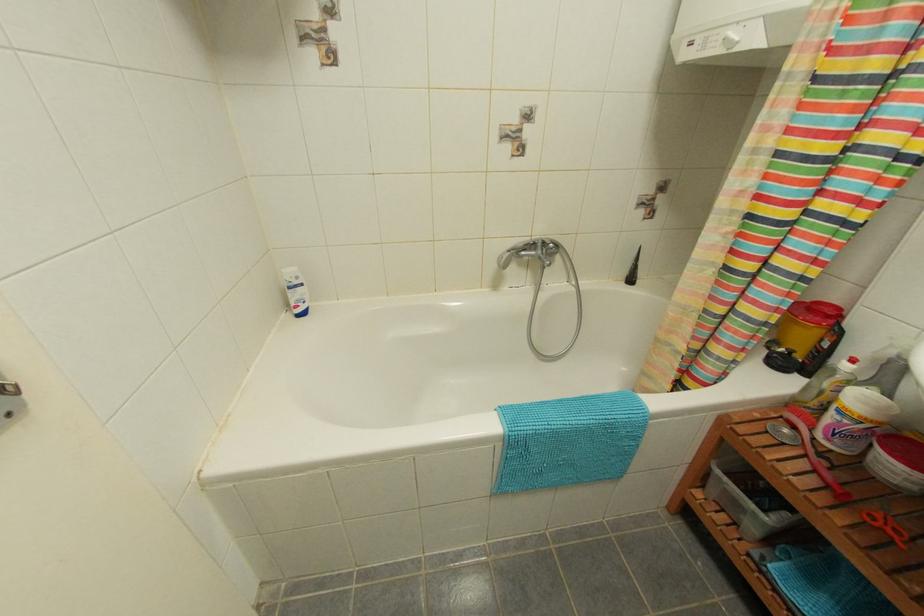
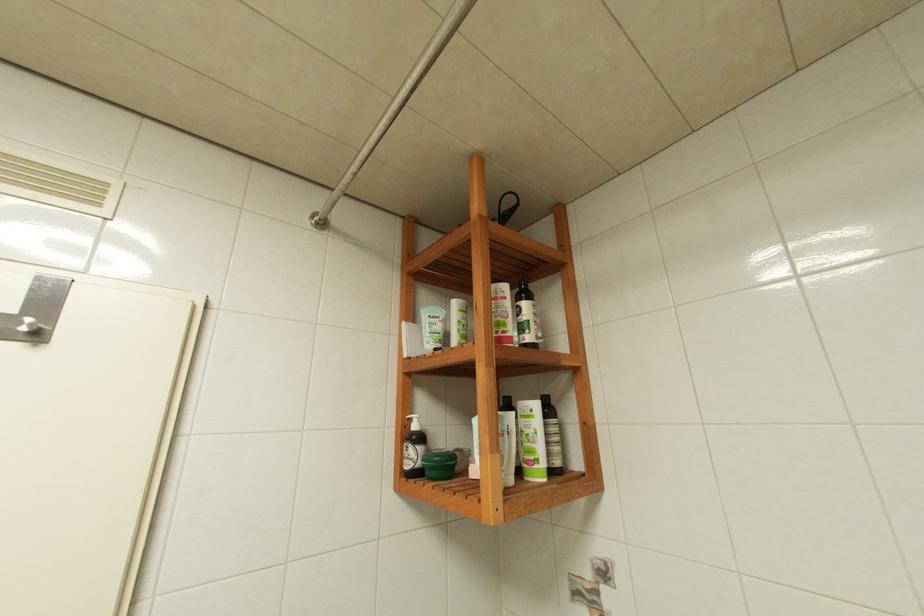
How did the camera likely rotate?

The rotation direction of the camera is left-up.